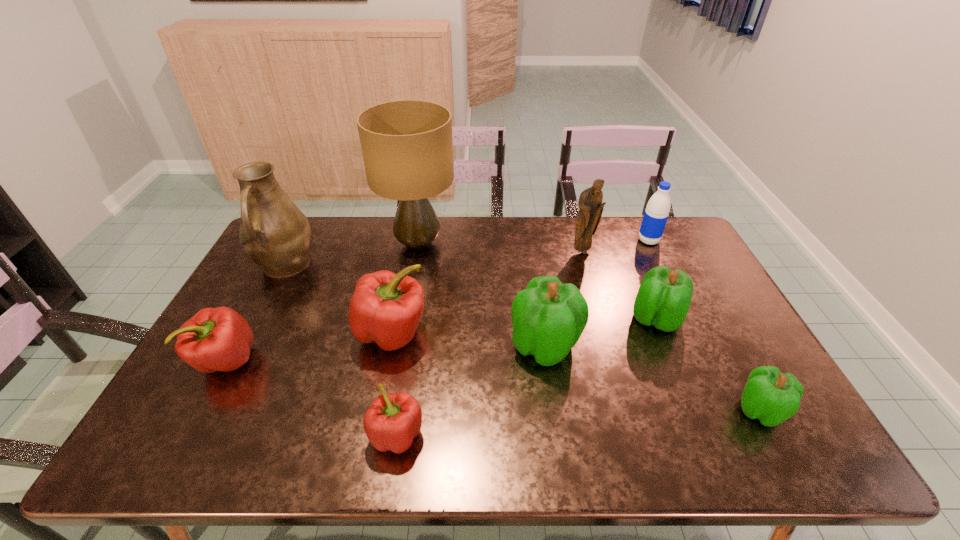
Where is `free space that is in between the beige lampshade and the leftmost bell pepper`? The height and width of the screenshot is (540, 960). free space that is in between the beige lampshade and the leftmost bell pepper is located at coordinates (323, 302).

Where is `empty space that is in between the rightmost green bell pepper and the nearest pink bell pepper`? This screenshot has height=540, width=960. empty space that is in between the rightmost green bell pepper and the nearest pink bell pepper is located at coordinates (578, 423).

This screenshot has width=960, height=540. I want to click on empty space between the smallest pink bell pepper and the rightmost green bell pepper, so click(578, 423).

Identify the location of vacant space that's between the second tallest object and the nearest pink bell pepper. This screenshot has height=540, width=960. pyautogui.click(x=341, y=350).

Where is `vacant area that lies between the smallest green bell pepper and the nearest pink bell pepper`? vacant area that lies between the smallest green bell pepper and the nearest pink bell pepper is located at coordinates (578, 423).

I want to click on vacant region between the biggest pink bell pepper and the water bottle, so click(x=520, y=287).

Point out which object is positioned as the fifth nearest to the fourth object from right to left. Please provide its 2D coordinates. Your answer should be formatted as a tuple, i.e. [(x, y)], where the tuple contains the x and y coordinates of a point satisfying the conditions above.

[(386, 308)]

I want to click on object that is the seventh closest to the seventh object from left to right, so click(392, 421).

Identify the location of bell pepper object that ranks as the fourth closest to the third tallest object. (772, 397).

Locate an element on the screen. The width and height of the screenshot is (960, 540). the third closest bell pepper to the smallest pink bell pepper is located at coordinates (215, 339).